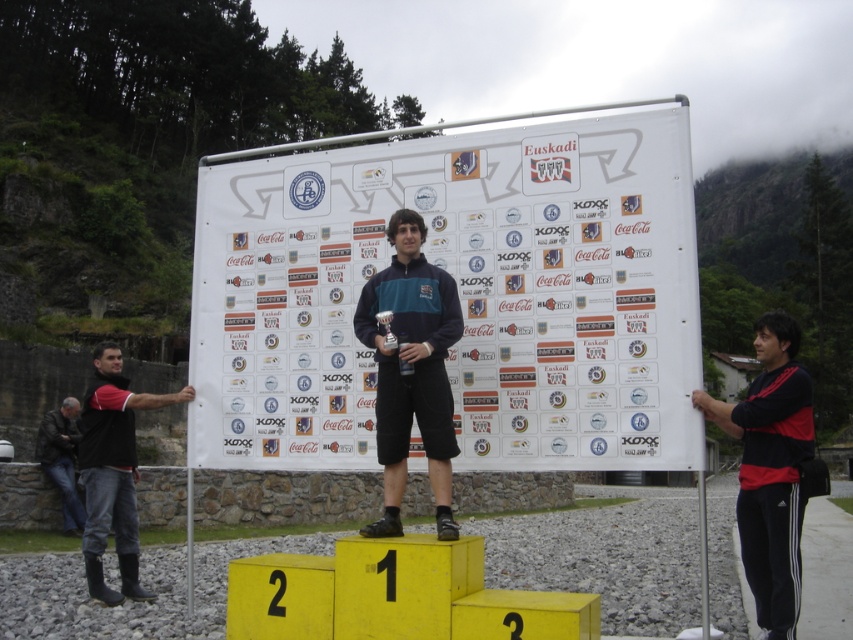
Question: Is dark blue jersey at center thinner than black rubber boots at left?

Choices:
 (A) yes
 (B) no

Answer: (A)

Question: Which of the following is the farthest from the observer?

Choices:
 (A) (80, 513)
 (B) (764, 316)

Answer: (A)

Question: Is dark blue jersey at center in front of black/red adidas tracksuit at right?

Choices:
 (A) yes
 (B) no

Answer: (A)

Question: Which object is farther from the camera taking this photo?

Choices:
 (A) dark blue jersey at center
 (B) black/red adidas tracksuit at right
 (C) black rubber boots at left
 (D) leather jacket at left

Answer: (D)

Question: Is black rubber boots at left to the right of leather jacket at left from the viewer's perspective?

Choices:
 (A) no
 (B) yes

Answer: (A)

Question: Among these objects, which one is farthest from the camera?

Choices:
 (A) dark blue jersey at center
 (B) leather jacket at left

Answer: (B)